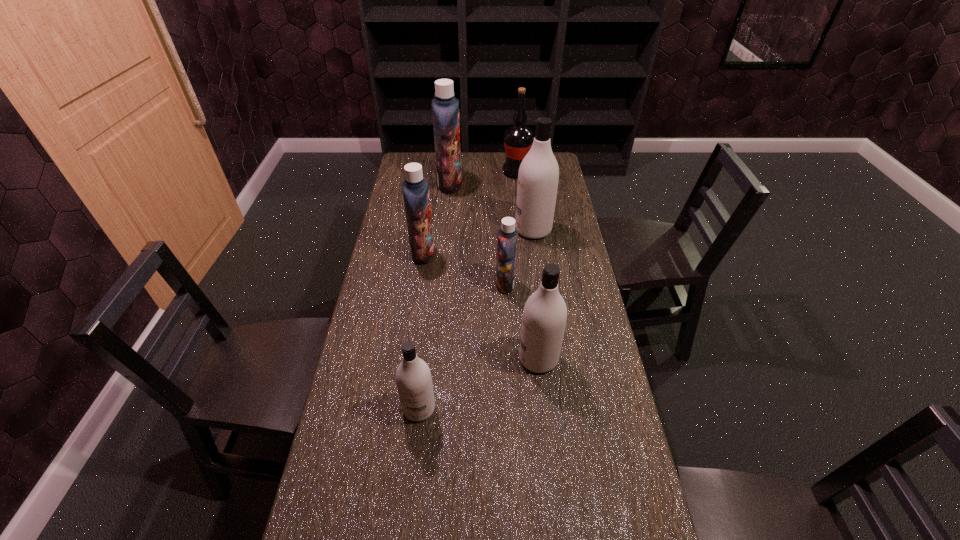
The image size is (960, 540). Identify the location of free region at the left edge. (348, 505).

Find the location of a particular element. The width and height of the screenshot is (960, 540). free space that is in between the red wine bottle and the second biggest white shampoo is located at coordinates (527, 265).

Where is `free spot between the fourth farthest shampoo and the biggest blue shampoo`? free spot between the fourth farthest shampoo and the biggest blue shampoo is located at coordinates (477, 234).

I want to click on vacant area that lies between the farthest shampoo and the smallest blue shampoo, so click(x=477, y=234).

Identify the location of vacant region between the wine bottle and the second biggest blue shampoo. (469, 213).

The width and height of the screenshot is (960, 540). Identify the location of free area in between the farthest shampoo and the second biggest white shampoo. (494, 271).

The width and height of the screenshot is (960, 540). What are the coordinates of `free space between the second biggest blue shampoo and the nearest blue shampoo` in the screenshot? It's located at (464, 268).

At what (x,y) coordinates should I click in order to perform the action: click on object identified as the second closest to the nearest blue shampoo. Please return your answer as a coordinate pair (x, y). Looking at the image, I should click on (544, 317).

Select which object is the third closest to the nearest object. Please provide its 2D coordinates. Your answer should be formatted as a tuple, i.e. [(x, y)], where the tuple contains the x and y coordinates of a point satisfying the conditions above.

[(415, 188)]

Find the location of a particular element. The image size is (960, 540). shampoo identified as the fourth closest to the smallest white shampoo is located at coordinates (538, 175).